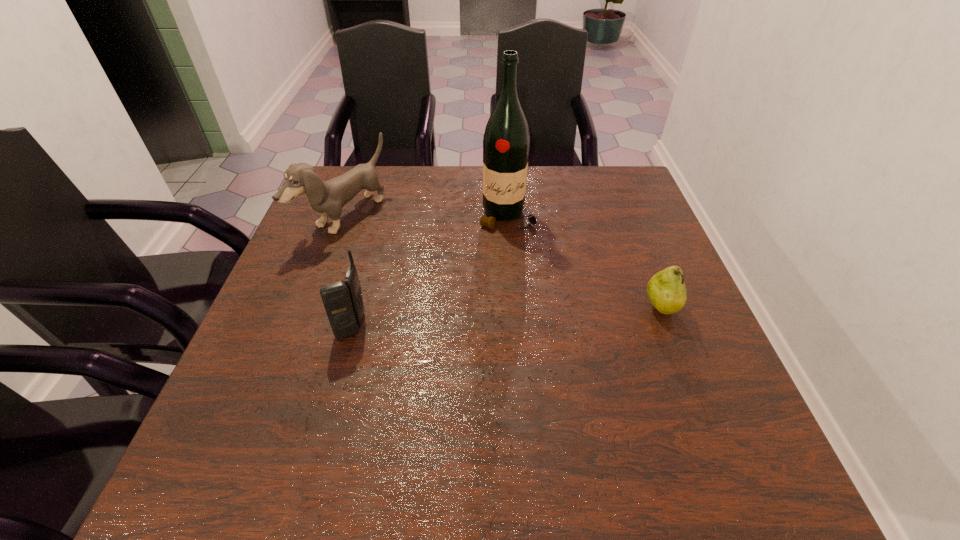
This screenshot has height=540, width=960. Identify the location of cellular telephone. (343, 302).

The image size is (960, 540). What are the coordinates of `pear` in the screenshot? It's located at (666, 290).

The height and width of the screenshot is (540, 960). I want to click on the shortest object, so click(666, 290).

At what (x,y) coordinates should I click in order to perform the action: click on the tallest object. Please return your answer as a coordinate pair (x, y). The image size is (960, 540). Looking at the image, I should click on (506, 141).

What are the coordinates of `the third object from left to right` in the screenshot? It's located at (506, 141).

The width and height of the screenshot is (960, 540). I want to click on puppy, so click(327, 198).

Identify the location of vacant space located on the keyboard of the cellular telephone. The width and height of the screenshot is (960, 540). (280, 326).

At what (x,y) coordinates should I click in order to perform the action: click on free space located 0.060m on the keyboard of the cellular telephone. Please return your answer as a coordinate pair (x, y). Looking at the image, I should click on (309, 326).

The height and width of the screenshot is (540, 960). What are the coordinates of `free space located 0.170m on the keyboard of the cellular telephone` in the screenshot? It's located at (256, 326).

Find the location of a particular element. The height and width of the screenshot is (540, 960). vacant space located on the left of the rightmost object is located at coordinates (547, 309).